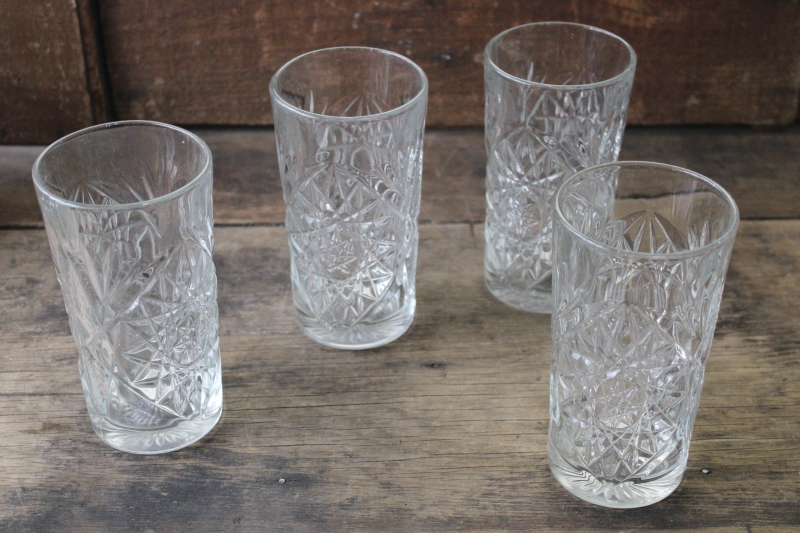
I want to click on rightmost glass, so 640,387.